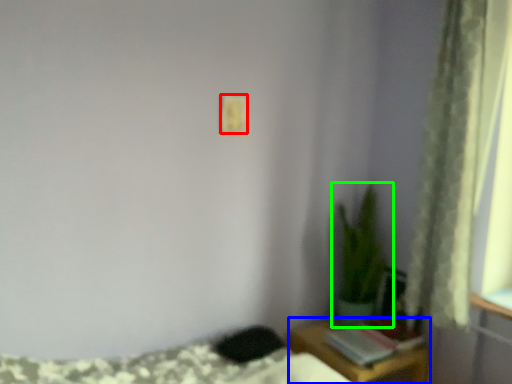
Question: Which object is positioned farthest from light switch (highlighted by a red box)? Select from table (highlighted by a blue box) and houseplant (highlighted by a green box).

Choices:
 (A) table
 (B) houseplant

Answer: (A)